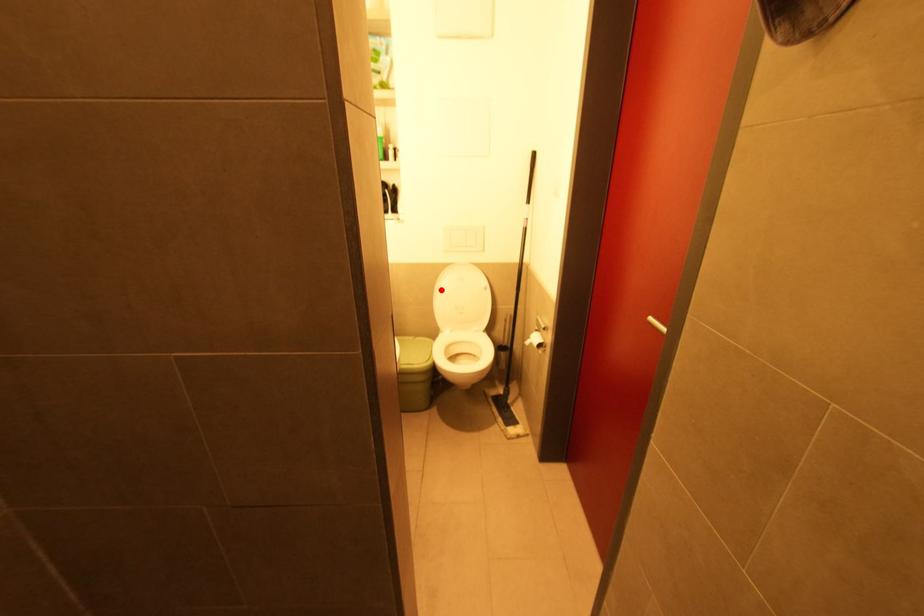
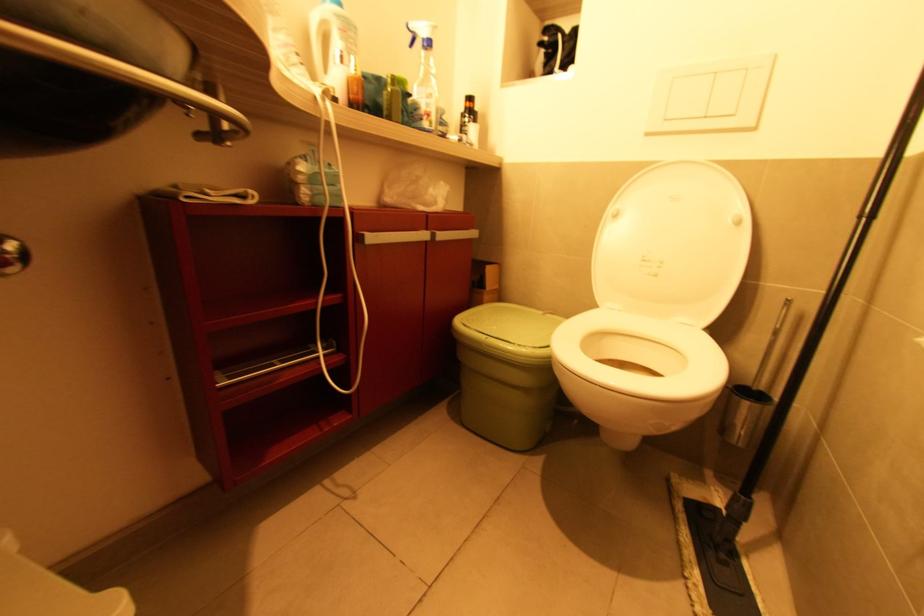
Locate, in the second image, the point that corresponds to the highlighted location in the first image.

(617, 217)